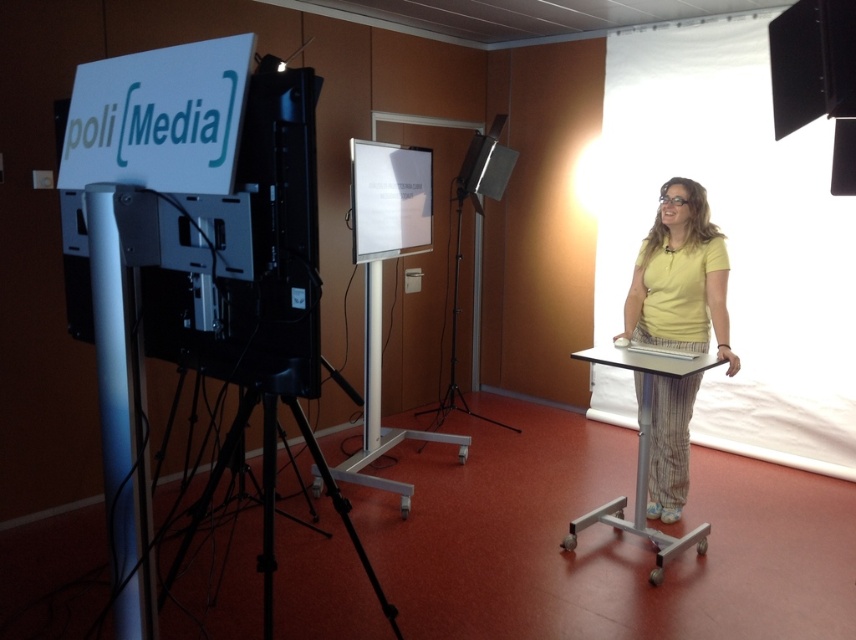
You are organizing a presentation and need to adjust the lighting. The white matte sign at upper left needs to be visible to the audience. Given that the large white curtain on the right allows bright light, should you position the black matte tripod at lower left closer to the curtain or away from it to ensure the sign is well lit?

The white matte sign at upper left is above the black matte tripod at lower left. To ensure the sign is well lit, position the black matte tripod at lower left closer to the curtain. This allows the bright light from the curtain to reach the sign more effectively, as the tripod being closer won not block the light since the sign is positioned above it.

You are organizing an event and need to place two black matte tripods in the room. The first is the black matte tripod at lower left and the second is the black matte tripod at center. According to the image, which tripod is located to the left of the other?

The black matte tripod at lower left is positioned on the left side of the black matte tripod at center.

You are setting up for an event and need to place a new banner between the white matte sign at upper left and the black matte tripod at lower left. Based on their sizes, which object should the banner be placed closer to?

The white matte sign at upper left is smaller than the black matte tripod at lower left, so the banner should be placed closer to the black matte tripod at lower left to maintain visual balance.